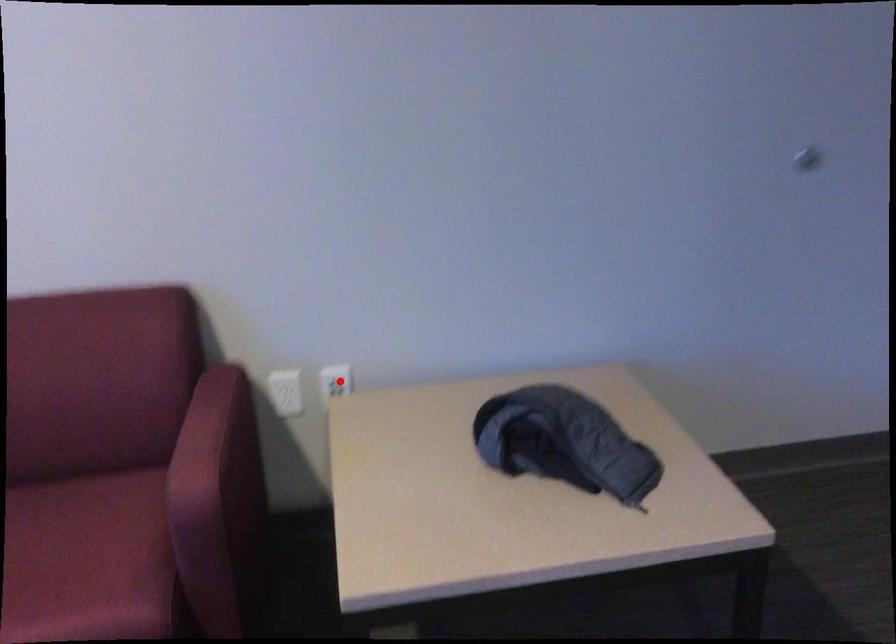
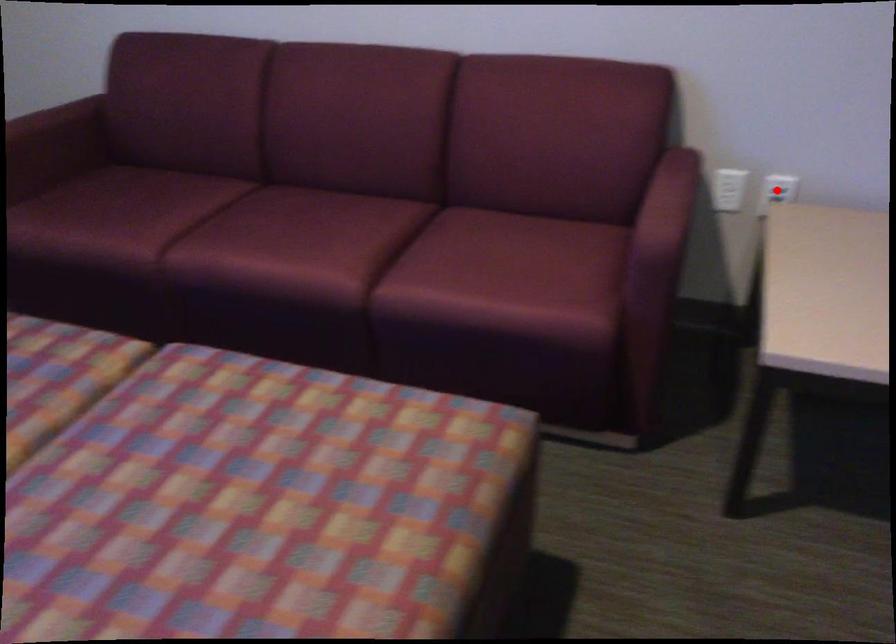
I am providing you with two images of the same scene from different viewpoints. A red point is marked on the first image and another point is marked on the second image. Do the highlighted points in image1 and image2 indicate the same real-world spot?

Yes